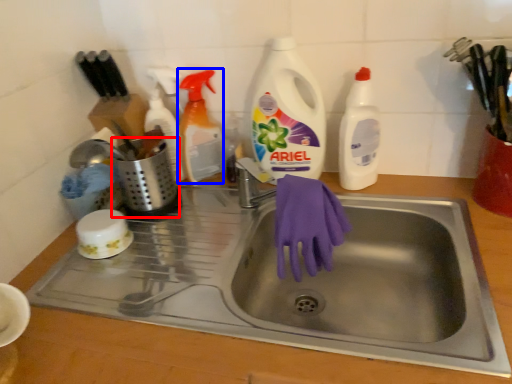
Question: Which object appears closest to the camera in this image, appliance (highlighted by a red box) or cleaning product (highlighted by a blue box)?

Choices:
 (A) appliance
 (B) cleaning product

Answer: (A)